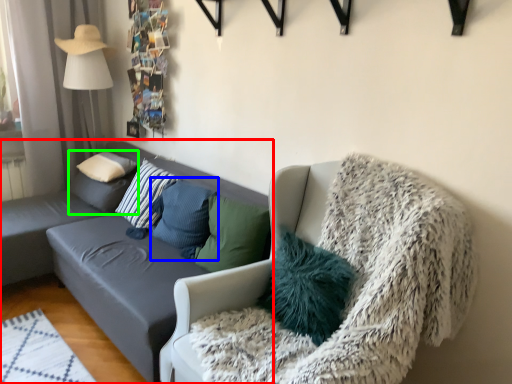
Question: Estimate the real-world distances between objects in this image. Which object is closer to studio couch (highlighted by a red box), pillow (highlighted by a blue box) or pillow (highlighted by a green box)?

Choices:
 (A) pillow
 (B) pillow

Answer: (A)